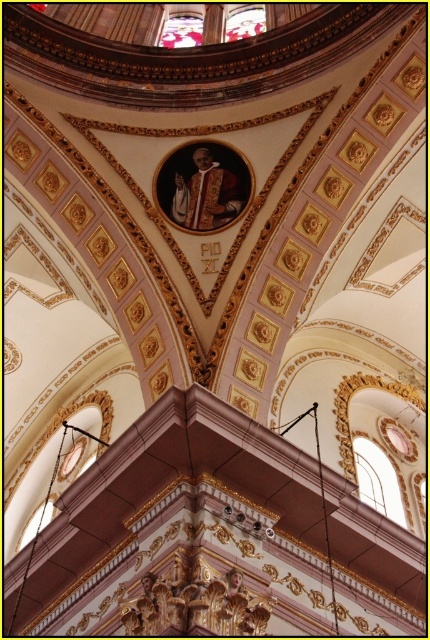
Which is below, clear glass window at upper center or transparent stained glass at upper center?

clear glass window at upper center is below.

Between clear glass window at upper center and transparent stained glass at upper center, which one appears on the left side from the viewer's perspective?

transparent stained glass at upper center is more to the left.

Which is in front, point (390, 470) or point (248, 17)?

Positioned in front is point (390, 470).

Locate an element on the screen. clear glass window at upper center is located at coordinates (378, 481).

Based on the photo, between clear glass window at upper center and transparent glass window at upper center, which one has less height?

Standing shorter between the two is clear glass window at upper center.

This screenshot has height=640, width=430. In order to click on clear glass window at upper center in this screenshot , I will do `click(378, 481)`.

Can you confirm if transparent glass window at upper center is positioned below transparent stained glass at upper center?

Correct, transparent glass window at upper center is located below transparent stained glass at upper center.

Is transparent glass window at upper center smaller than transparent stained glass at upper center?

No.

Which is in front, point (165, 28) or point (254, 8)?

Point (165, 28)

The image size is (430, 640). I want to click on transparent glass window at upper center, so click(181, 29).